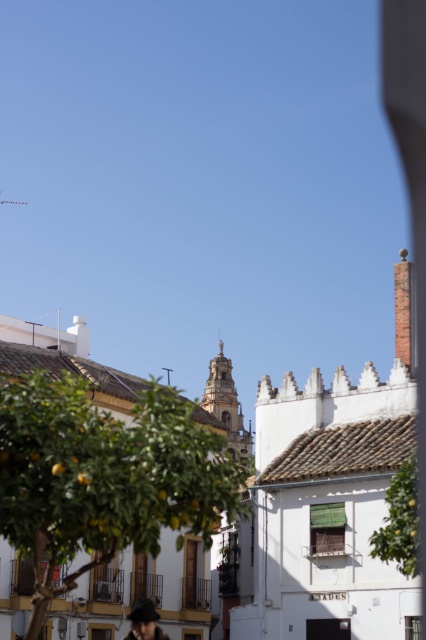
Can you confirm if golden stone tower at center is positioned to the right of matte black hat at lower center?

Correct, you'll find golden stone tower at center to the right of matte black hat at lower center.

Between golden stone tower at center and matte black hat at lower center, which one is positioned higher?

matte black hat at lower center

Identify the location of golden stone tower at center. (227, 406).

Is green leafy tree at center to the left of golden stone tower at center from the viewer's perspective?

Correct, you'll find green leafy tree at center to the left of golden stone tower at center.

Which is behind, point (60, 440) or point (233, 448)?

The point (233, 448) is more distant.

The height and width of the screenshot is (640, 426). What are the coordinates of `green leafy tree at center` in the screenshot? It's located at (103, 477).

Is point (293, 490) positioned after point (216, 356)?

No, (293, 490) is in front of (216, 356).

Does white textured building at center appear on the right side of golden stone tower at center?

Indeed, white textured building at center is positioned on the right side of golden stone tower at center.

This screenshot has width=426, height=640. What are the coordinates of `white textured building at center` in the screenshot? It's located at (325, 502).